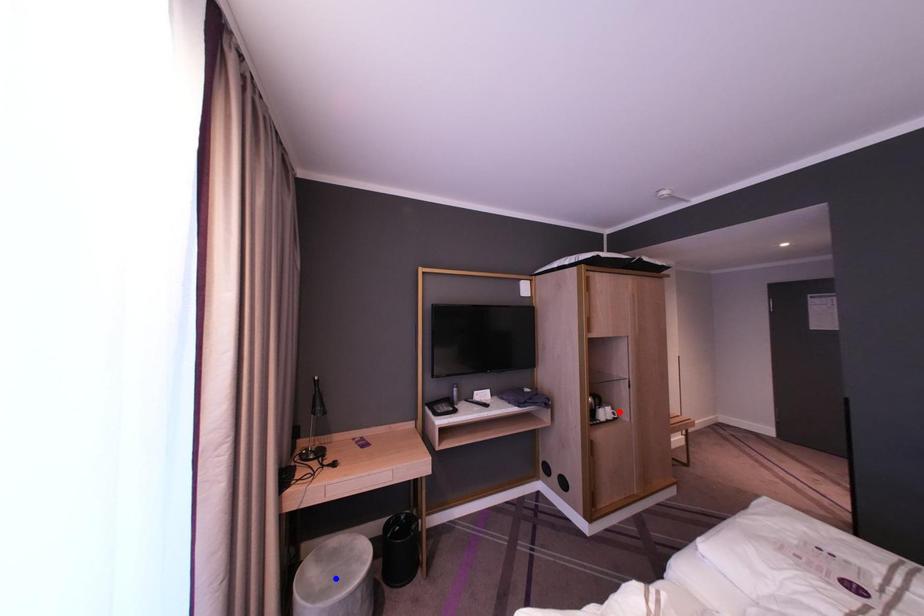
Question: Which of the two points in the image is closer to the camera?

Choices:
 (A) Blue point is closer.
 (B) Red point is closer.

Answer: (A)